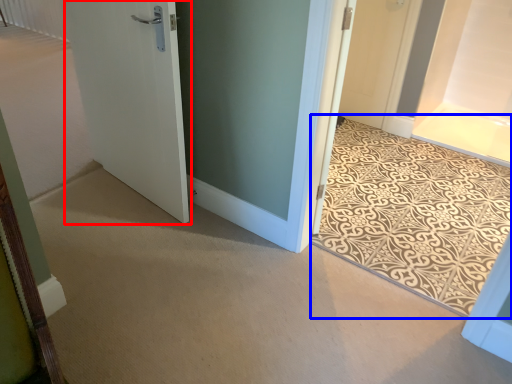
Question: Among these objects, which one is nearest to the camera, door (highlighted by a red box) or doormat (highlighted by a blue box)?

Choices:
 (A) door
 (B) doormat

Answer: (B)